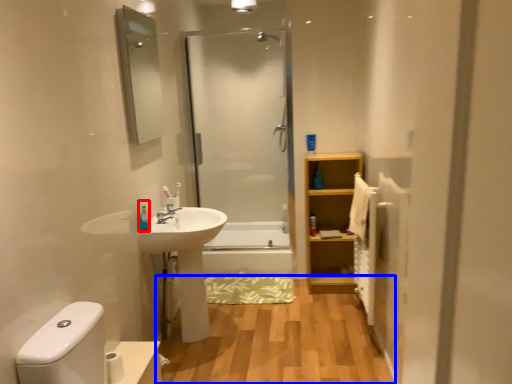
Question: Which of the following is the closest to the observer, toiletry (highlighted by a red box) or hardwood (highlighted by a blue box)?

Choices:
 (A) toiletry
 (B) hardwood

Answer: (B)